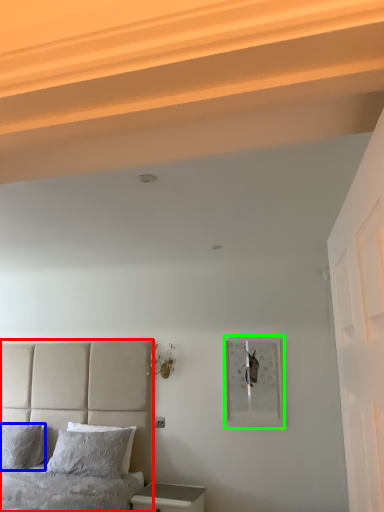
Question: Based on their relative distances, which object is nearer to bed (highlighted by a red box)? Choose from pillow (highlighted by a blue box) and picture frame (highlighted by a green box).

Choices:
 (A) pillow
 (B) picture frame

Answer: (A)